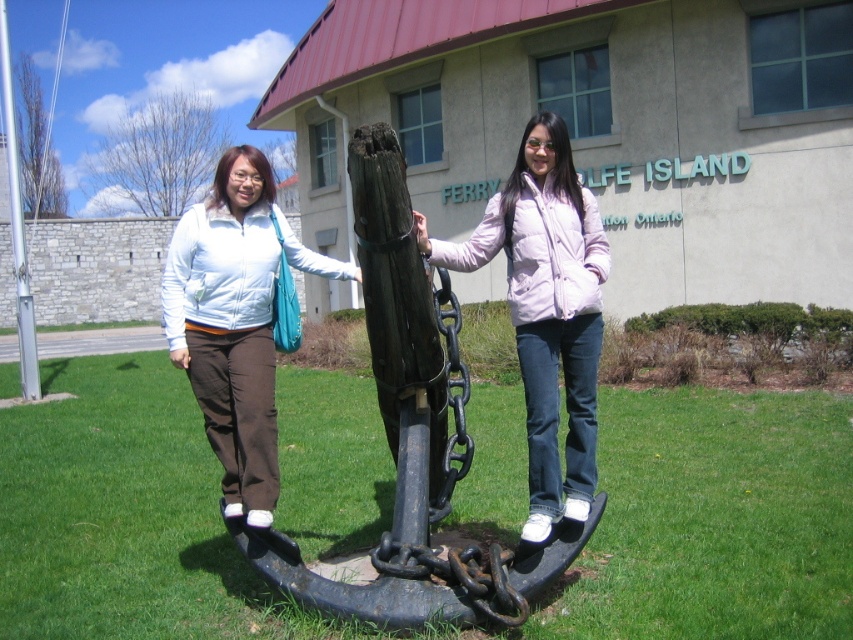
You are a photographer trying to capture a photo of the light pink puffy jacket at center and the silver metallic pole at left. Based on their positions, which object is located to the left of the other?

The silver metallic pole at left is located to the left of the light pink puffy jacket at center.

You are a photographer trying to capture a photo of the light pink puffy jacket at center and the silver metallic pole at left. Based on their positions, which object would appear closer to the camera in the photo?

The light pink puffy jacket at center appears closer to the camera because it is positioned below the silver metallic pole at left, indicating it is in a lower plane and thus nearer to the viewer.